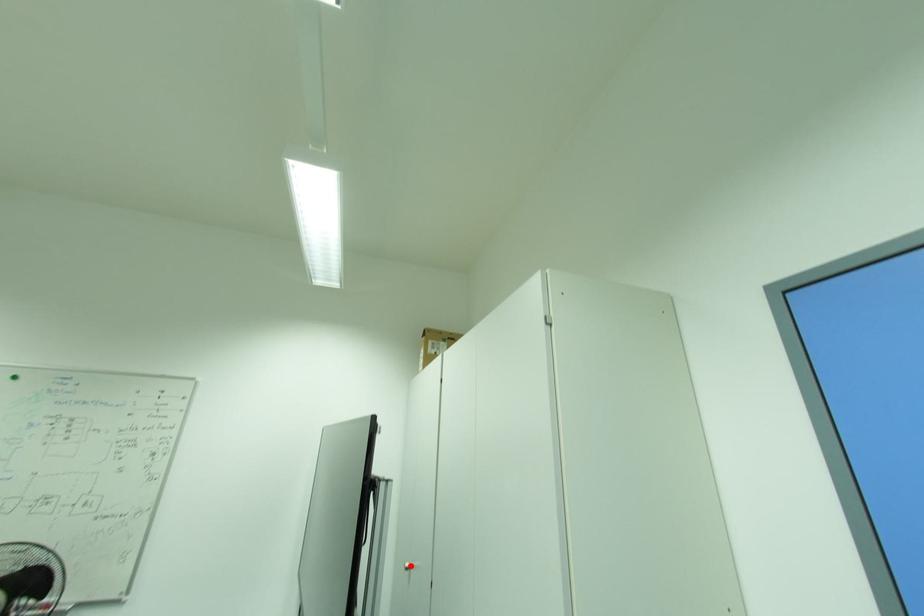
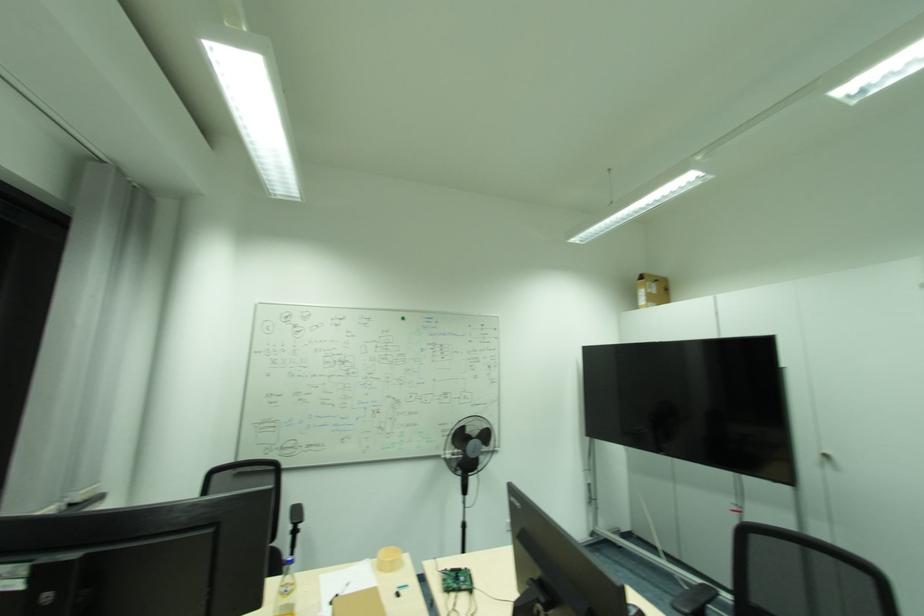
Question: I am providing you with two images of the same scene from different viewpoints. A red point is marked on the first image. Is the red point's position out of view in image 2?

Choices:
 (A) Yes
 (B) No

Answer: (A)